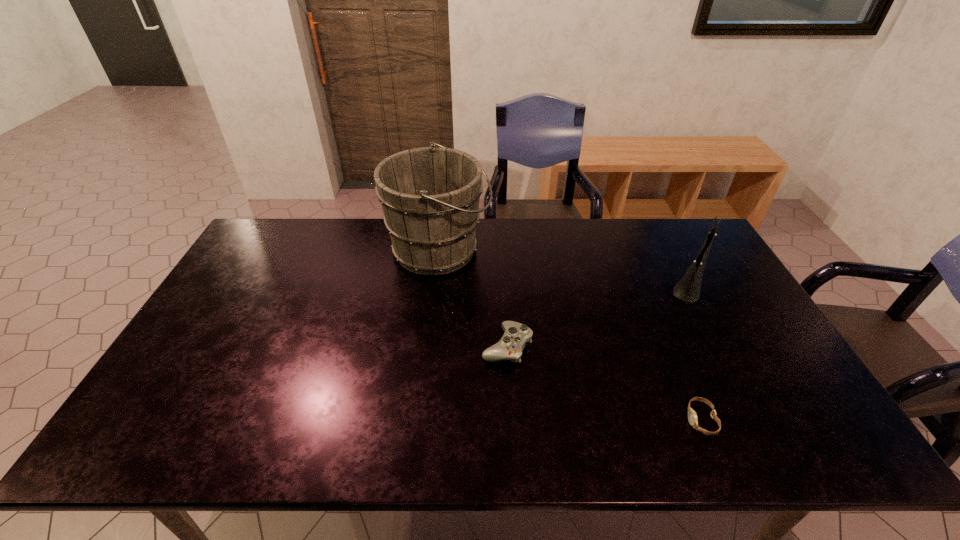
You are a GUI agent. You are given a task and a screenshot of the screen. Output one action in this format:
    pyautogui.click(x=<x>, y=<y>)
    Task: Click on the vacant space located 0.330m on the face of the shortest object
    
    Given the screenshot: What is the action you would take?
    pyautogui.click(x=546, y=420)

You are a GUI agent. You are given a task and a screenshot of the screen. Output one action in this format:
    pyautogui.click(x=<x>, y=<y>)
    Task: Click on the free region located 0.230m on the face of the shortest object
    This screenshot has width=960, height=540.
    Given the screenshot: What is the action you would take?
    pyautogui.click(x=589, y=420)

This screenshot has height=540, width=960. What are the coordinates of `blank space located 0.110m on the face of the shortest object` in the screenshot? It's located at tap(640, 420).

Locate an element on the screen. Image resolution: width=960 pixels, height=540 pixels. object present at the far edge is located at coordinates (430, 196).

At what (x,y) coordinates should I click in order to perform the action: click on object that is positioned at the near edge. Please return your answer as a coordinate pair (x, y). The width and height of the screenshot is (960, 540). Looking at the image, I should click on (692, 415).

The width and height of the screenshot is (960, 540). Identify the location of object at the right edge. (688, 288).

The image size is (960, 540). I want to click on vacant space at the far edge of the desktop, so click(579, 222).

Where is `vacant space at the near edge`? The image size is (960, 540). vacant space at the near edge is located at coordinates (602, 446).

Identify the location of vacant space at the left edge of the desktop. The height and width of the screenshot is (540, 960). (163, 405).

The image size is (960, 540). In the image, there is a desktop. Identify the location of vacant space at the right edge. (756, 354).